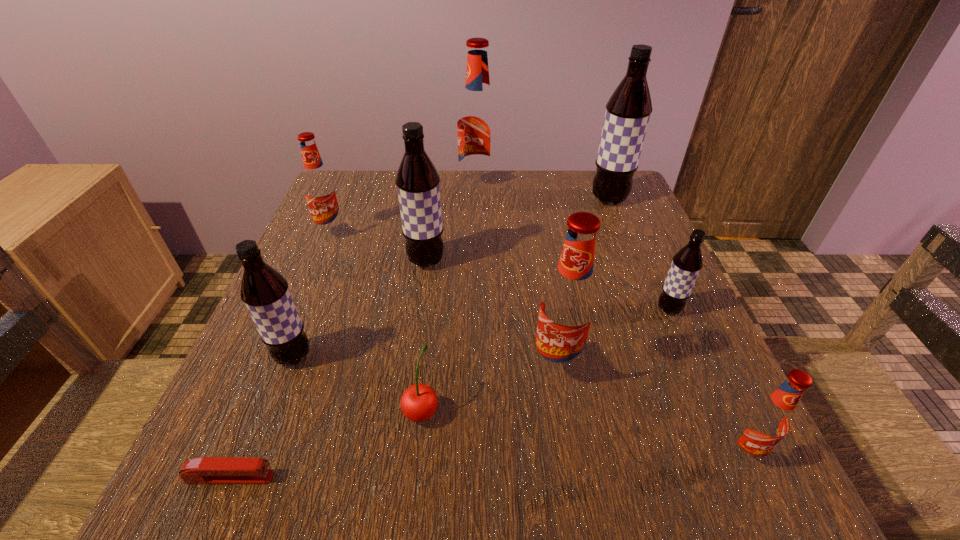
I want to click on free spot between the second biggest brown root beer and the second farthest red root beer, so click(x=379, y=247).

At what (x,y) coordinates should I click in order to perform the action: click on empty space that is in between the ninth tallest object and the biggest brown root beer. Please return your answer as a coordinate pair (x, y). Looking at the image, I should click on (516, 305).

The height and width of the screenshot is (540, 960). I want to click on empty space between the stapler and the fourth object from right to left, so click(x=394, y=422).

You are a GUI agent. You are given a task and a screenshot of the screen. Output one action in this format:
    pyautogui.click(x=<x>, y=<y>)
    Task: Click on the free spot between the smallest brown root beer and the third red root beer from left to right
    
    Given the screenshot: What is the action you would take?
    pyautogui.click(x=613, y=338)

Locate an element on the screen. This screenshot has width=960, height=540. empty space between the red stapler and the third biggest brown root beer is located at coordinates (262, 417).

The width and height of the screenshot is (960, 540). I want to click on free space between the second smallest brown root beer and the sixth nearest object, so (x=481, y=333).

At what (x,y) coordinates should I click in order to perform the action: click on free space between the nearest brown root beer and the second biggest red root beer. Please return your answer as a coordinate pair (x, y). Looking at the image, I should click on (425, 362).

In order to click on unoccupied position between the rightmost red root beer and the eighth farthest object in this screenshot , I will do `click(582, 431)`.

The height and width of the screenshot is (540, 960). I want to click on free area in between the biggest brown root beer and the fifth object from right to left, so click(543, 193).

This screenshot has width=960, height=540. What are the coordinates of `the ninth closest object to the smallest red root beer` in the screenshot? It's located at point(320,191).